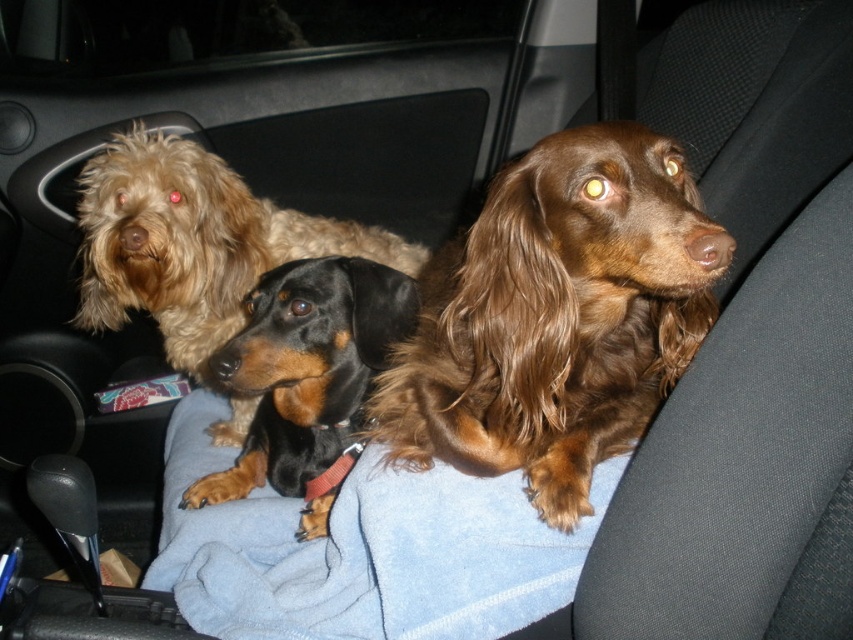
Question: Based on their relative distances, which object is farther from the fuzzy brown dog at upper left?

Choices:
 (A) black smooth dachshund at center
 (B) brown silky dog at center
 (C) blue fleece blanket at center

Answer: (B)

Question: Which point appears closest to the camera in this image?

Choices:
 (A) (201, 368)
 (B) (567, 468)
 (C) (317, 465)

Answer: (B)

Question: Does blue fleece blanket at center have a greater width compared to black smooth dachshund at center?

Choices:
 (A) no
 (B) yes

Answer: (B)

Question: Which point is closer to the camera taking this photo?

Choices:
 (A) (173, 272)
 (B) (543, 376)
 (C) (276, 506)
 (D) (311, 424)

Answer: (B)

Question: Does blue fleece blanket at center have a smaller size compared to black smooth dachshund at center?

Choices:
 (A) no
 (B) yes

Answer: (A)

Question: Can you confirm if blue fleece blanket at center is positioned to the right of black smooth dachshund at center?

Choices:
 (A) no
 (B) yes

Answer: (A)